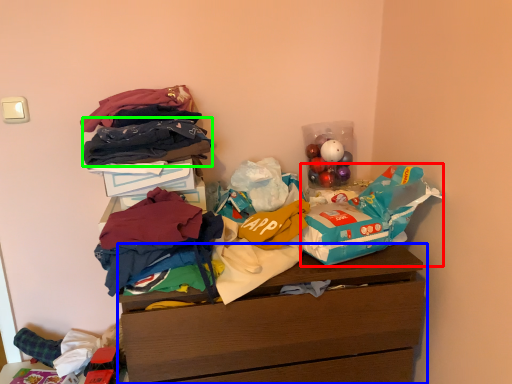
Question: Estimate the real-world distances between objects in this image. Which object is closer to grocery bag (highlighted by a red box), chest of drawers (highlighted by a blue box) or clothing (highlighted by a green box)?

Choices:
 (A) chest of drawers
 (B) clothing

Answer: (A)